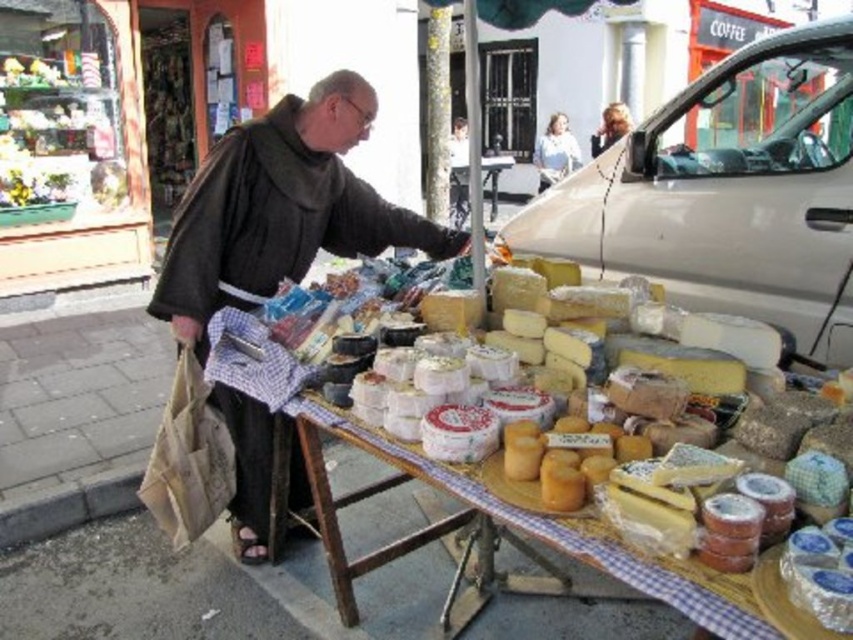
Can you confirm if dark brown woolen robe at center is thinner than wooden table at center?

In fact, dark brown woolen robe at center might be wider than wooden table at center.

Identify the location of dark brown woolen robe at center. (281, 209).